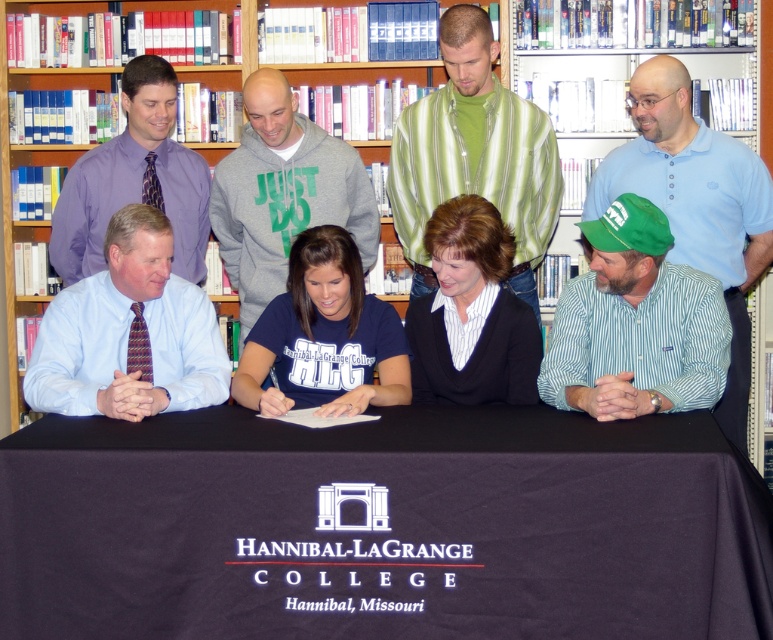
Question: Which object is the closest to the wooden bookcase at upper center?

Choices:
 (A) green striped shirt at lower right
 (B) green striped shirt at upper center
 (C) purple shirt at upper left
 (D) black sweater at center

Answer: (B)

Question: Is green fabric cap at right thinner than green striped shirt at upper center?

Choices:
 (A) no
 (B) yes

Answer: (B)

Question: Which object is farther from the camera taking this photo?

Choices:
 (A) purple shirt at upper left
 (B) black sweater at center
 (C) wooden bookcase at upper center
 (D) navy blue t-shirt at center

Answer: (C)

Question: Can you confirm if green fabric cap at right is thinner than navy blue t-shirt at center?

Choices:
 (A) yes
 (B) no

Answer: (B)

Question: Estimate the real-world distances between objects in this image. Which object is farther from the blue shirt at left?

Choices:
 (A) green striped shirt at lower right
 (B) purple shirt at upper left

Answer: (A)

Question: Is green fabric cap at right further to camera compared to navy blue t-shirt at center?

Choices:
 (A) no
 (B) yes

Answer: (A)